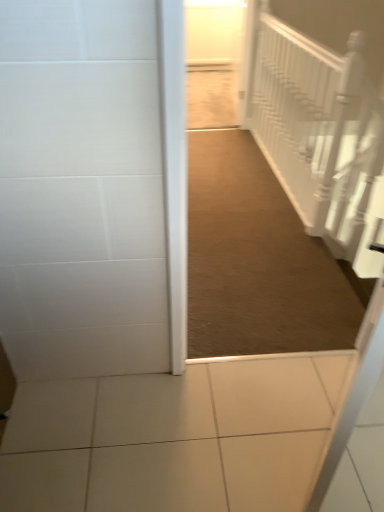
Question: Looking at their shapes, would you say white textured stairwell at upper right is wider or thinner than brown carpet at center?

Choices:
 (A) thin
 (B) wide

Answer: (A)

Question: From a real-world perspective, is white textured stairwell at upper right above or below brown carpet at center?

Choices:
 (A) above
 (B) below

Answer: (A)

Question: Considering their positions, is white textured stairwell at upper right located in front of or behind brown carpet at center?

Choices:
 (A) behind
 (B) front

Answer: (A)

Question: Do you think brown carpet at center is within white textured stairwell at upper right, or outside of it?

Choices:
 (A) outside
 (B) inside

Answer: (A)

Question: Considering the positions of brown carpet at center and white textured stairwell at upper right in the image, is brown carpet at center wider or thinner than white textured stairwell at upper right?

Choices:
 (A) thin
 (B) wide

Answer: (B)

Question: From the image's perspective, is brown carpet at center located above or below white textured stairwell at upper right?

Choices:
 (A) above
 (B) below

Answer: (B)

Question: From a real-world perspective, relative to white textured stairwell at upper right, is brown carpet at center vertically above or below?

Choices:
 (A) below
 (B) above

Answer: (A)